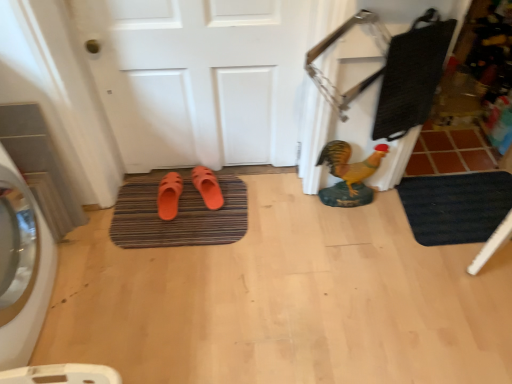
Identify the location of vacant space that is to the left of orange rubber slipper at center, marked as the 2th footwear in a right-to-left arrangement. Image resolution: width=512 pixels, height=384 pixels. (133, 203).